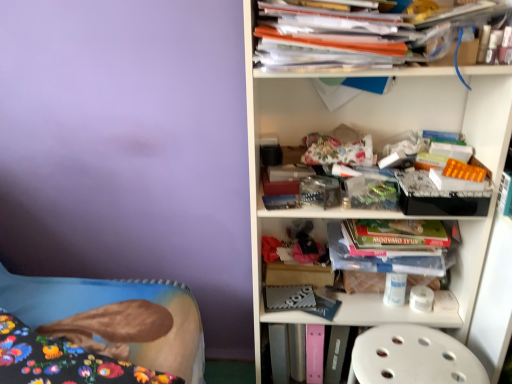
Question: From a real-world perspective, is translucent plastic container at center, arranged as the 2th shelf when viewed from the top, above or below white plastic step stool at lower right?

Choices:
 (A) above
 (B) below

Answer: (A)

Question: Is translucent plastic container at center, arranged as the 2th shelf when viewed from the top, taller or shorter than white plastic step stool at lower right?

Choices:
 (A) tall
 (B) short

Answer: (A)

Question: Based on their relative distances, which object is nearer to the white plastic step stool at lower right?

Choices:
 (A) hardcover book at center, which ranks as the 2th paperback book in top-to-bottom order
 (B) translucent plastic container at center, arranged as the 2th shelf when viewed from the top
 (C) white plastic shelf at upper right, acting as the 2th shelf starting from the bottom
 (D) fluffy fabric bed at lower left
 (E) purple matte wall at upper left

Answer: (B)

Question: Estimate the real-world distances between objects in this image. Which object is farther from the purple matte wall at upper left?

Choices:
 (A) white plastic step stool at lower right
 (B) white plastic shelf at upper right, which ranks as the first shelf in top-to-bottom order
 (C) white textured paperback book at center, which appears as the 2th paperback book when ordered from the bottom
 (D) orange plastic folder at upper right
 (E) fluffy fabric bed at lower left

Answer: (A)